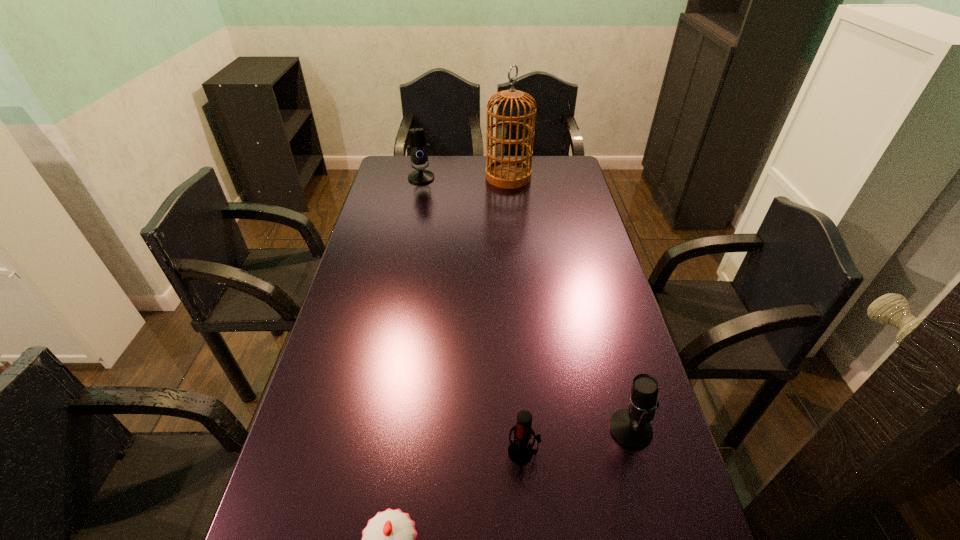
At what (x,y) coordinates should I click in order to perform the action: click on vacant space that satisfies the following two spatial constraints: 1. on the stand of the fourth tallest object; 2. on the right side of the leftmost microphone. Please return your answer as a coordinate pair (x, y). This screenshot has width=960, height=540. Looking at the image, I should click on (x=368, y=452).

At what (x,y) coordinates should I click in order to perform the action: click on free space that satisfies the following two spatial constraints: 1. on the stand of the rightmost microphone; 2. on the right side of the leftmost microphone. Please return your answer as a coordinate pair (x, y). Looking at the image, I should click on (372, 429).